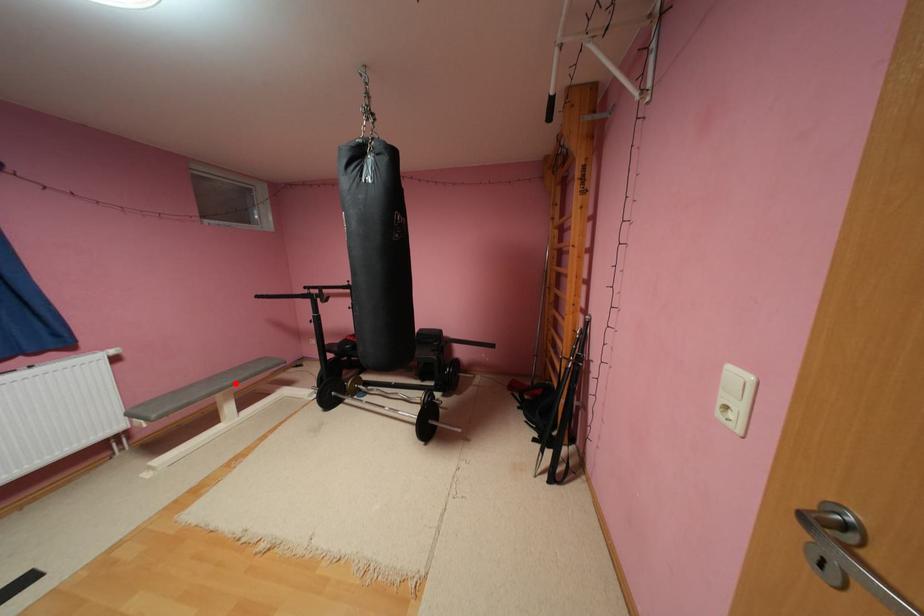
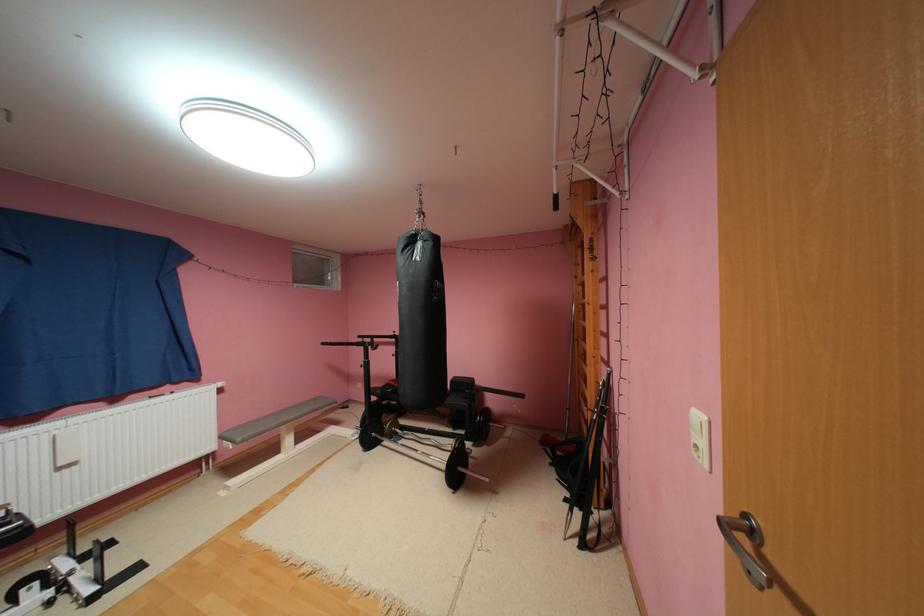
Question: I am providing you with two images of the same scene from different viewpoints. A red point is shown in image1. For the corresponding object point in image2, is it positioned nearer or farther from the camera?

Choices:
 (A) Nearer
 (B) Farther

Answer: (B)